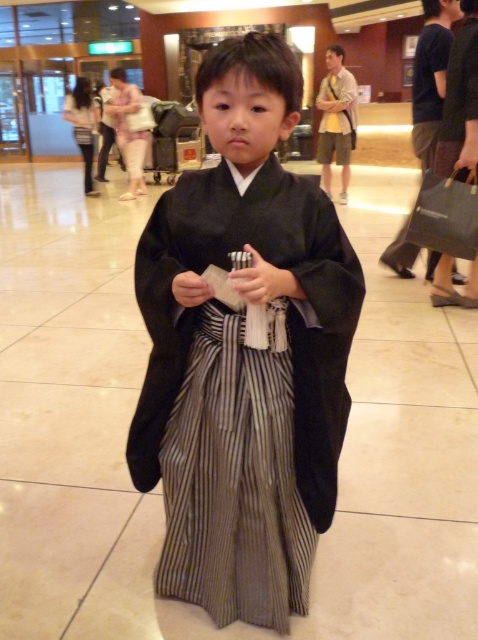
You are a photographer at a Shichi Go San event. You need to capture a photo of the black silk kimono at center and striped cotton kimono at center. Which kimono should you focus on if you want to highlight the larger one?

The black silk kimono at center is larger in size than the striped cotton kimono at center, so you should focus on the black silk kimono at center to highlight the larger one.

You are standing in the center of the image and want to move to the black silk kimono at center. Which direction should you move to reach it?

Since the black silk kimono at center is already at the center of the image, you don not need to move in any direction to reach it.

You are a photographer at a Shichi Go San event and need to capture a photo of the child wearing the black silk kimono at center and the striped cotton kimono at center. Since the space is limited, will the two kimonos fit side by side in the frame if the camera can only accommodate a total width of 1.2 meters?

The black silk kimono at center is larger in width than the striped cotton kimono at center, but the combined width of both kimonos is not provided. Therefore, it is impossible to determine if they will fit within the 1.2 meters frame without additional information.